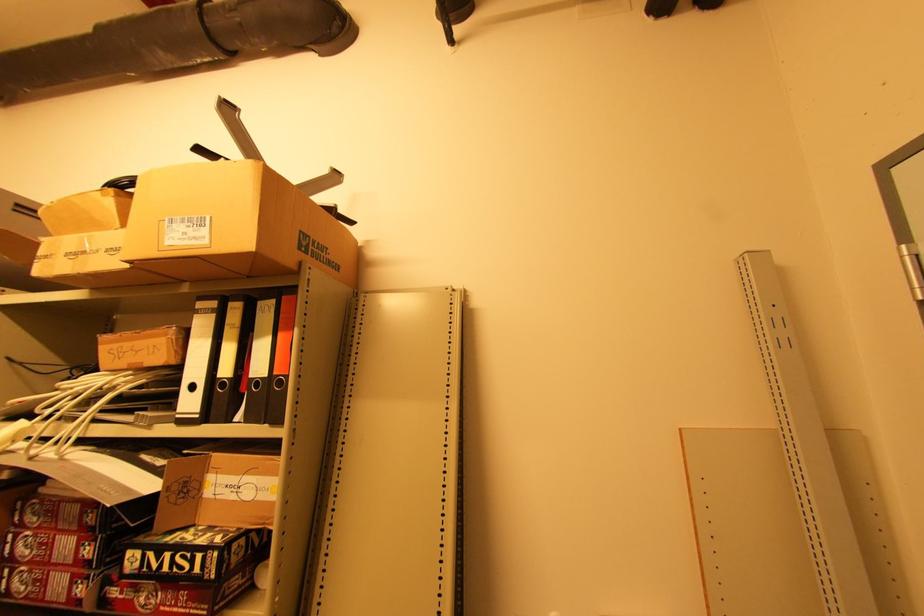
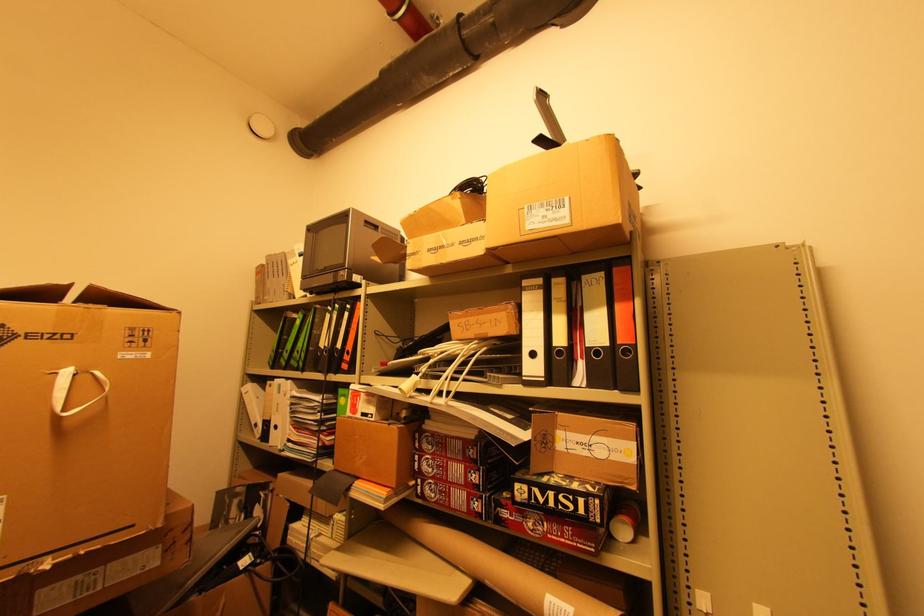
Find the pixel in the second image that matches point (186, 557) in the first image.

(568, 498)